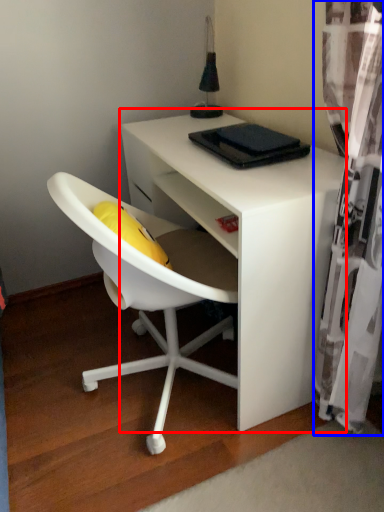
Question: Which object appears farthest to the camera in this image, desk (highlighted by a red box) or curtain (highlighted by a blue box)?

Choices:
 (A) desk
 (B) curtain

Answer: (A)